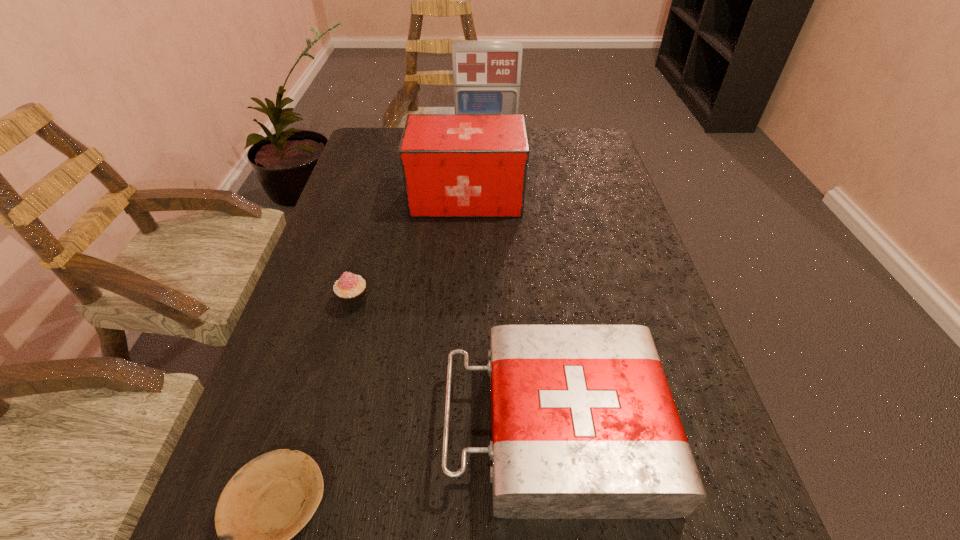
Where is `vacant space located 0.100m on the front side of the nearest first-aid kit`? This screenshot has width=960, height=540. vacant space located 0.100m on the front side of the nearest first-aid kit is located at coordinates (386, 427).

You are a GUI agent. You are given a task and a screenshot of the screen. Output one action in this format:
    pyautogui.click(x=<x>, y=<y>)
    Task: Click on the vacant space located 0.360m on the back of the third nearest object
    The height and width of the screenshot is (540, 960).
    Given the screenshot: What is the action you would take?
    pyautogui.click(x=384, y=193)

Find the location of a particular element. object located in the far edge section of the desktop is located at coordinates (486, 74).

Where is `object at the left edge`? object at the left edge is located at coordinates (350, 289).

Identify the location of object that is at the right edge. (584, 426).

In order to click on free space at the far edge of the desktop in this screenshot , I will do `click(547, 153)`.

I want to click on free space at the left edge, so click(388, 213).

The height and width of the screenshot is (540, 960). What are the coordinates of `free space at the right edge` in the screenshot? It's located at tap(601, 249).

This screenshot has width=960, height=540. I want to click on vacant space at the far left corner of the desktop, so click(x=370, y=149).

In the image, there is a desktop. What are the coordinates of `blank space at the far right corner` in the screenshot? It's located at (567, 164).